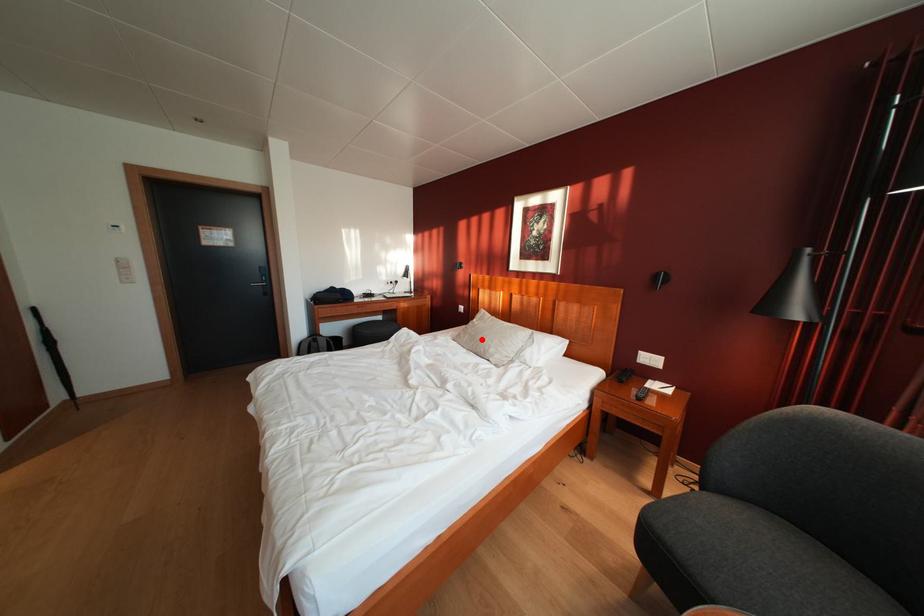
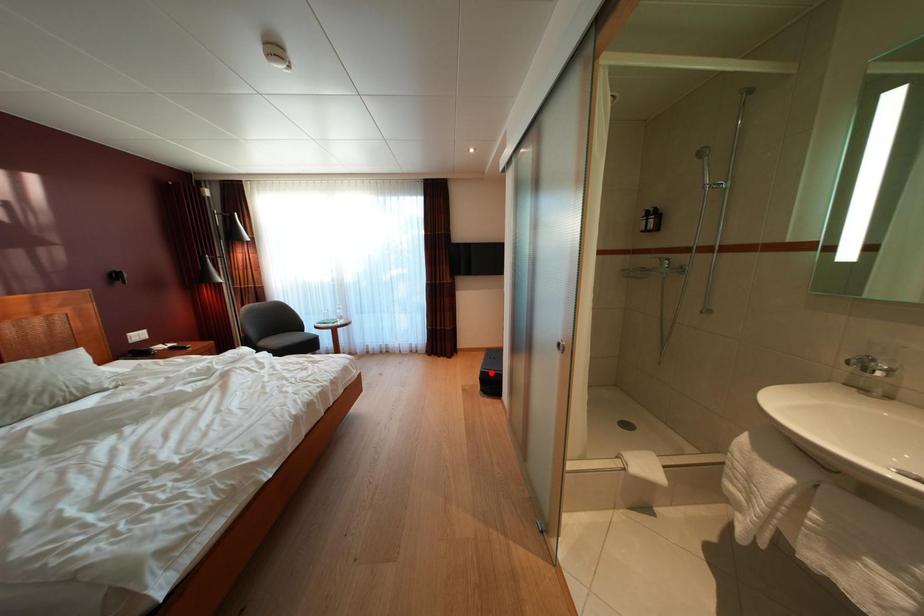
I am providing you with two images of the same scene from different viewpoints. A red point is marked on the first image and another point is marked on the second image. Is the red point in image1 aligned with the point shown in image2?

No